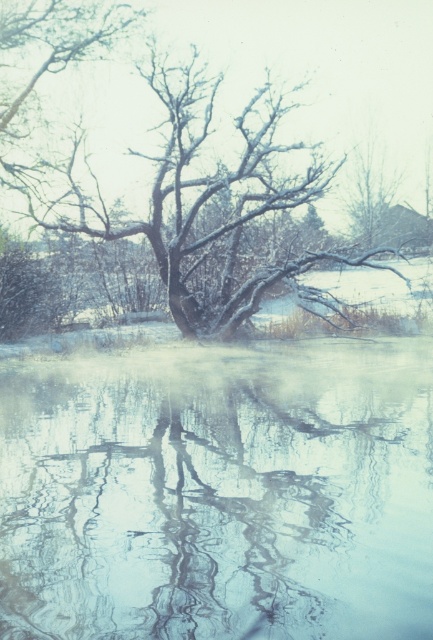
Question: Which point appears farthest from the camera in this image?

Choices:
 (A) (419, 90)
 (B) (64, 579)

Answer: (A)

Question: Which point is closer to the camera?

Choices:
 (A) [x=15, y=67]
 (B) [x=100, y=525]

Answer: (B)

Question: Can you confirm if translucent icy water at center is wider than snow-covered branches at center?

Choices:
 (A) yes
 (B) no

Answer: (B)

Question: Is translucent icy water at center further to the viewer compared to snow-covered branches at center?

Choices:
 (A) yes
 (B) no

Answer: (B)

Question: Is translucent icy water at center below snow-covered branches at center?

Choices:
 (A) no
 (B) yes

Answer: (B)